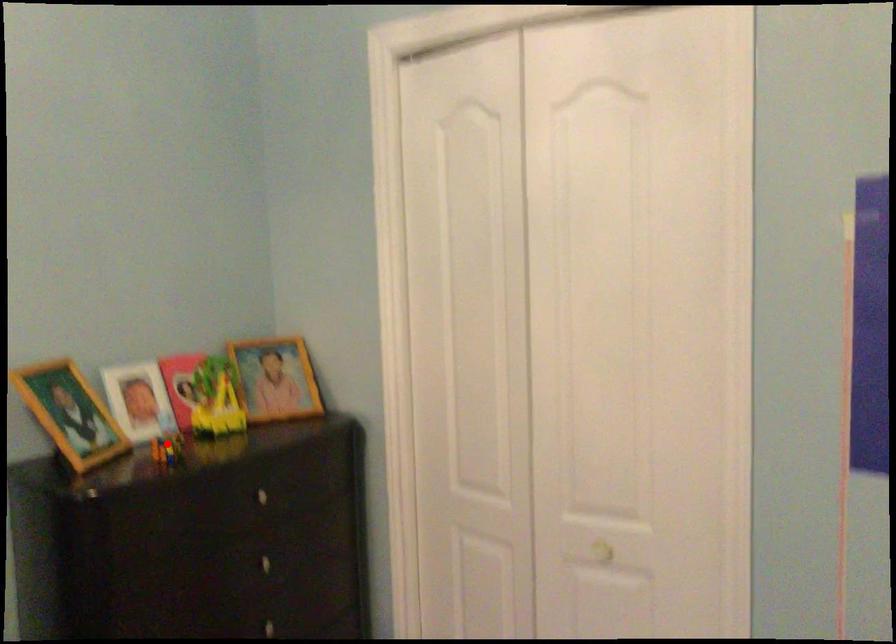
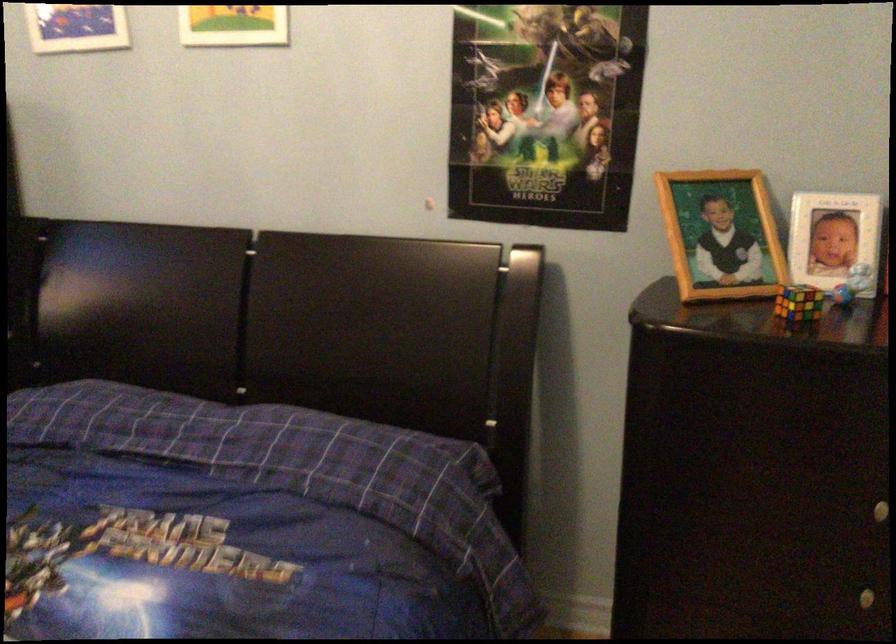
Find the pixel in the second image that matches the highlighted location in the first image.

(798, 303)